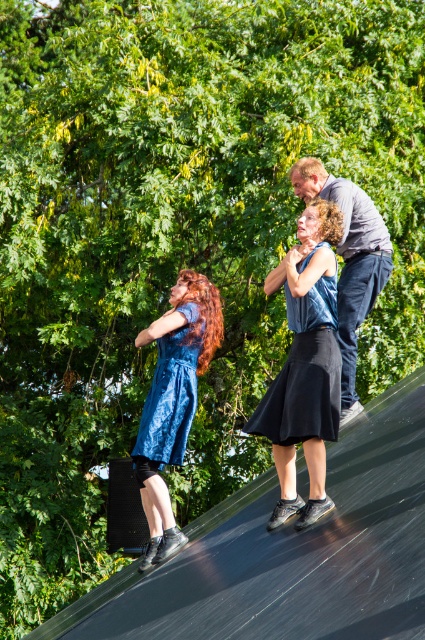
You are a photographer setting up for a group photo. You need to ensure that the black matte dress at center and the dark gray shirt at upper right are both visible in the frame. Based on their positions, which one is closer to the bottom of the image?

The black matte dress at center is positioned under the dark gray shirt at upper right, so the black matte dress at center is closer to the bottom of the image.

You are a photographer preparing to take a group photo of the blue satin dress at center and the dark gray shirt at upper right. Based on their sizes, which one should you position closer to the camera to ensure both appear equally sized in the photo?

The blue satin dress at center is larger in size compared to the dark gray shirt at upper right. To make them appear equally sized in the photo, position the dark gray shirt at upper right closer to the camera since it is smaller.